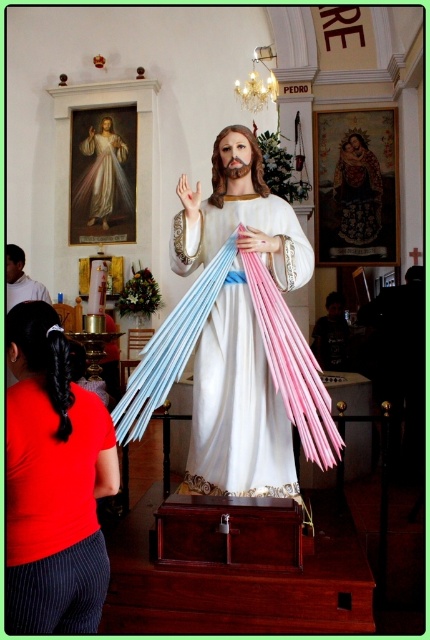
Question: Is red pinstripe pants at lower left bigger than embroidered fabric portrait at upper center?

Choices:
 (A) no
 (B) yes

Answer: (B)

Question: Does matte red shirt at center have a smaller size compared to white glossy robe at upper center?

Choices:
 (A) yes
 (B) no

Answer: (B)

Question: Does red pinstripe pants at lower left have a smaller size compared to white glossy robe at upper center?

Choices:
 (A) yes
 (B) no

Answer: (A)

Question: Which object is the closest to the red pinstripe pants at lower left?

Choices:
 (A) white glossy robe at upper center
 (B) matte red shirt at center
 (C) embroidered fabric portrait at upper center

Answer: (B)

Question: Which point is farther from the camera taking this photo?

Choices:
 (A) (129, 192)
 (B) (61, 486)
 (C) (202, 486)

Answer: (A)

Question: Which object appears farthest from the camera in this image?

Choices:
 (A) matte red shirt at center
 (B) white glossy robe at upper center
 (C) red pinstripe pants at lower left

Answer: (B)